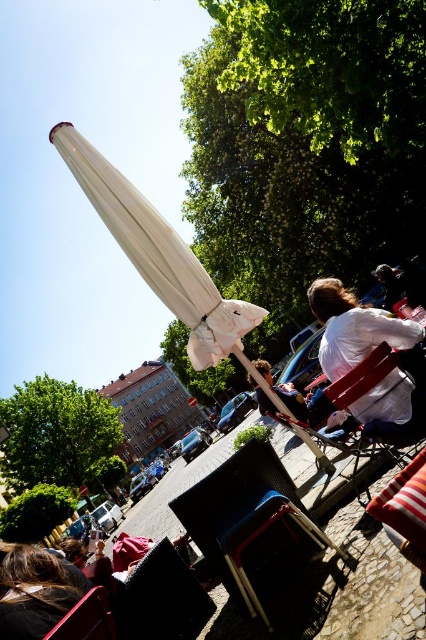
Does white cotton shirt at right appear over matte black chair at lower left?

Indeed, white cotton shirt at right is positioned over matte black chair at lower left.

Is white cotton shirt at right wider than matte black chair at lower left?

Correct, the width of white cotton shirt at right exceeds that of matte black chair at lower left.

This screenshot has height=640, width=426. I want to click on white cotton shirt at right, so click(x=354, y=326).

Which of these two, black textured cushion at lower center or matte black chair at lower left, stands shorter?

With less height is matte black chair at lower left.

You are a GUI agent. You are given a task and a screenshot of the screen. Output one action in this format:
    pyautogui.click(x=<x>, y=<y>)
    Task: Click on the black textured cushion at lower center
    
    Given the screenshot: What is the action you would take?
    pyautogui.click(x=161, y=598)

Consider the image. Which of these two, black plastic beach chair at center or black textured cushion at lower center, stands taller?

black plastic beach chair at center

Who is more distant from viewer, (247, 472) or (140, 604)?

Positioned behind is point (247, 472).

Which is behind, point (299, 499) or point (135, 625)?

Positioned behind is point (299, 499).

Find the location of `black plastic beach chair at center`. black plastic beach chair at center is located at coordinates (250, 525).